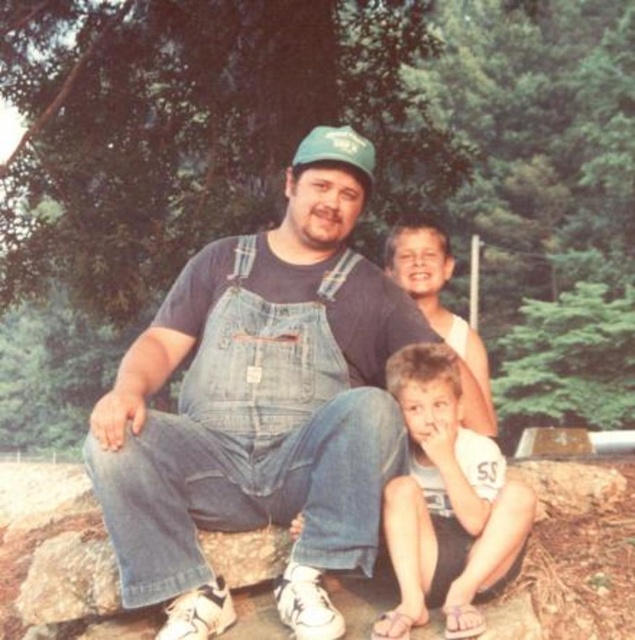
You are a photographer trying to capture a candid shot of the denim overalls at center and the light brown hair at lower center. Given that your camera has a maximum focus range of 12 inches, will you be able to focus on both subjects simultaneously?

The denim overalls at center and light brown hair at lower center are 12.14 inches apart. Since the distance between them exceeds the camera focus range of 12 inches, the camera cannot focus on both subjects simultaneously.

Looking at the scene, which object is located below the other between the light brown hair at lower center and the smooth tan skin at upper center?

The light brown hair at lower center is positioned under the smooth tan skin at upper center.

You are a photographer trying to capture a group photo of the denim overalls at center and the light brown hair at lower center. Which subject should you focus on first if you want to ensure both are in frame and properly sized?

The denim overalls at center is larger in size than light brown hair at lower center, so you should focus on the denim overalls at center first to ensure proper sizing for both subjects.